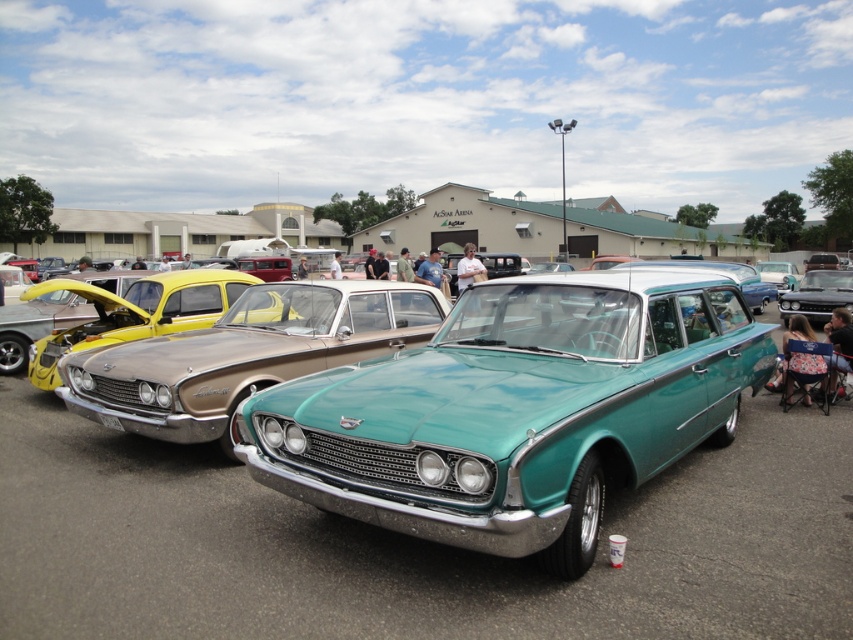
Who is higher up, teal glossy car at center or shiny black car at center?

Positioned higher is shiny black car at center.

Where is `teal glossy car at center`? teal glossy car at center is located at coordinates (515, 412).

Is teal glossy car at center to the left of gold metallic sedan at center from the viewer's perspective?

No, teal glossy car at center is not to the left of gold metallic sedan at center.

Can you confirm if teal glossy car at center is positioned to the right of gold metallic sedan at center?

Correct, you'll find teal glossy car at center to the right of gold metallic sedan at center.

Which is in front, point (462, 529) or point (90, 337)?

Point (462, 529) is in front.

Find the location of `teal glossy car at center`. teal glossy car at center is located at coordinates (515, 412).

Who is shorter, gold metallic sedan at center or shiny black car at center?

Standing shorter between the two is shiny black car at center.

Does gold metallic sedan at center have a lesser width compared to shiny black car at center?

No, gold metallic sedan at center is not thinner than shiny black car at center.

Measure the distance between gold metallic sedan at center and camera.

The distance of gold metallic sedan at center from camera is 6.83 meters.

Find the location of `gold metallic sedan at center`. gold metallic sedan at center is located at coordinates (138, 314).